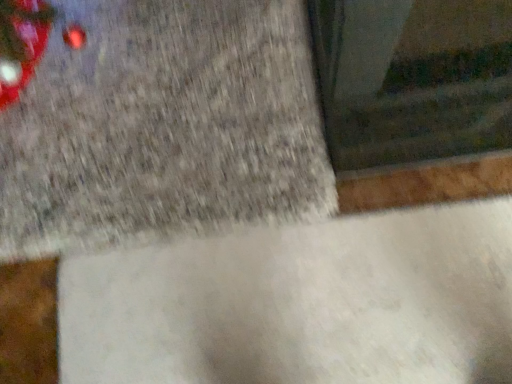
Question: Does white matte concrete at center, which is the 2th concrete in top-to-bottom order, have a lesser height compared to gray concrete at upper left, the second concrete ordered from the bottom?

Choices:
 (A) no
 (B) yes

Answer: (B)

Question: From a real-world perspective, is white matte concrete at center, which is the 2th concrete in top-to-bottom order, beneath gray concrete at upper left, the second concrete ordered from the bottom?

Choices:
 (A) yes
 (B) no

Answer: (A)

Question: Considering the relative sizes of white matte concrete at center, which is the first concrete from bottom to top, and gray concrete at upper left, the first concrete positioned from the top, in the image provided, is white matte concrete at center, which is the first concrete from bottom to top, smaller than gray concrete at upper left, the first concrete positioned from the top,?

Choices:
 (A) yes
 (B) no

Answer: (A)

Question: Is white matte concrete at center, which is the first concrete from bottom to top, to the right of gray concrete at upper left, the second concrete ordered from the bottom, from the viewer's perspective?

Choices:
 (A) yes
 (B) no

Answer: (A)

Question: Is white matte concrete at center, which is the 2th concrete in top-to-bottom order, aimed at gray concrete at upper left, the second concrete ordered from the bottom?

Choices:
 (A) yes
 (B) no

Answer: (A)

Question: Can you confirm if white matte concrete at center, which is the first concrete from bottom to top, is thinner than gray concrete at upper left, the second concrete ordered from the bottom?

Choices:
 (A) yes
 (B) no

Answer: (A)

Question: Does gray concrete at upper left, the first concrete positioned from the top, have a smaller size compared to white matte concrete at center, which is the first concrete from bottom to top?

Choices:
 (A) no
 (B) yes

Answer: (A)

Question: Does gray concrete at upper left, the second concrete ordered from the bottom, have a greater height compared to white matte concrete at center, which is the first concrete from bottom to top?

Choices:
 (A) yes
 (B) no

Answer: (A)

Question: Does gray concrete at upper left, the first concrete positioned from the top, have a lesser width compared to white matte concrete at center, which is the 2th concrete in top-to-bottom order?

Choices:
 (A) yes
 (B) no

Answer: (B)

Question: Is gray concrete at upper left, the first concrete positioned from the top, in front of white matte concrete at center, which is the first concrete from bottom to top?

Choices:
 (A) yes
 (B) no

Answer: (B)

Question: Is gray concrete at upper left, the first concrete positioned from the top, shorter than white matte concrete at center, which is the 2th concrete in top-to-bottom order?

Choices:
 (A) yes
 (B) no

Answer: (B)

Question: Could white matte concrete at center, which is the first concrete from bottom to top, be considered to be inside gray concrete at upper left, the first concrete positioned from the top?

Choices:
 (A) no
 (B) yes

Answer: (A)

Question: Considering the positions of gray concrete at upper left, the first concrete positioned from the top, and white matte concrete at center, which is the first concrete from bottom to top, in the image, is gray concrete at upper left, the first concrete positioned from the top, taller or shorter than white matte concrete at center, which is the first concrete from bottom to top,?

Choices:
 (A) short
 (B) tall

Answer: (B)